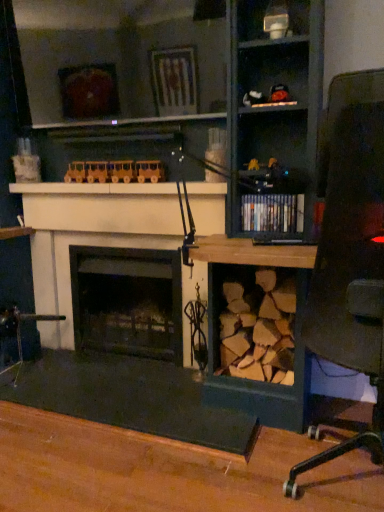
Question: From a real-world perspective, is matte black toy car at upper center, the first toy positioned from the right, below black matte fireplace at center, which appears as the 2th fireplace when viewed from the front?

Choices:
 (A) yes
 (B) no

Answer: (B)

Question: Considering the relative sizes of matte black toy car at upper center, the first toy positioned from the top, and black matte fireplace at center, acting as the first fireplace starting from the back, in the image provided, is matte black toy car at upper center, the first toy positioned from the top, thinner than black matte fireplace at center, acting as the first fireplace starting from the back,?

Choices:
 (A) yes
 (B) no

Answer: (A)

Question: Is matte black toy car at upper center, which ranks as the 2th toy in back-to-front order, facing towards black matte fireplace at center, acting as the first fireplace starting from the back?

Choices:
 (A) yes
 (B) no

Answer: (B)

Question: Considering the relative sizes of matte black toy car at upper center, which ranks as the 2th toy in back-to-front order, and black matte fireplace at center, acting as the first fireplace starting from the back, in the image provided, is matte black toy car at upper center, which ranks as the 2th toy in back-to-front order, taller than black matte fireplace at center, acting as the first fireplace starting from the back,?

Choices:
 (A) yes
 (B) no

Answer: (B)

Question: Considering the relative sizes of matte black toy car at upper center, which is counted as the 1th toy, starting from the front, and black matte fireplace at center, acting as the first fireplace starting from the back, in the image provided, is matte black toy car at upper center, which is counted as the 1th toy, starting from the front, bigger than black matte fireplace at center, acting as the first fireplace starting from the back,?

Choices:
 (A) no
 (B) yes

Answer: (A)

Question: From the image's perspective, is white matte fireplace at center, positioned as the 1th fireplace in front-to-back order, located above or below wooden desk at center?

Choices:
 (A) above
 (B) below

Answer: (B)

Question: Visually, is white matte fireplace at center, acting as the 2th fireplace starting from the back, positioned to the left or to the right of wooden desk at center?

Choices:
 (A) right
 (B) left

Answer: (A)

Question: Is white matte fireplace at center, acting as the 2th fireplace starting from the back, taller or shorter than wooden desk at center?

Choices:
 (A) tall
 (B) short

Answer: (B)

Question: Is white matte fireplace at center, acting as the 2th fireplace starting from the back, in front of or behind wooden desk at center in the image?

Choices:
 (A) behind
 (B) front

Answer: (A)

Question: From a real-world perspective, is black matte fireplace at center, acting as the first fireplace starting from the back, physically located above or below white matte fireplace at center, acting as the 2th fireplace starting from the back?

Choices:
 (A) above
 (B) below

Answer: (B)

Question: In terms of height, does black matte fireplace at center, which appears as the 2th fireplace when viewed from the front, look taller or shorter compared to white matte fireplace at center, positioned as the 1th fireplace in front-to-back order?

Choices:
 (A) short
 (B) tall

Answer: (A)

Question: Which is correct: black matte fireplace at center, which appears as the 2th fireplace when viewed from the front, is inside white matte fireplace at center, acting as the 2th fireplace starting from the back, or outside of it?

Choices:
 (A) outside
 (B) inside

Answer: (A)

Question: Considering the positions of black matte fireplace at center, acting as the first fireplace starting from the back, and white matte fireplace at center, positioned as the 1th fireplace in front-to-back order, in the image, is black matte fireplace at center, acting as the first fireplace starting from the back, wider or thinner than white matte fireplace at center, positioned as the 1th fireplace in front-to-back order,?

Choices:
 (A) wide
 (B) thin

Answer: (A)

Question: Would you say white glossy vase at upper center is to the left or to the right of wooden train at upper center, which is the 1th toy from left to right, in the picture?

Choices:
 (A) right
 (B) left

Answer: (A)

Question: Does point (273, 22) appear closer or farther from the camera than point (114, 179)?

Choices:
 (A) farther
 (B) closer

Answer: (B)